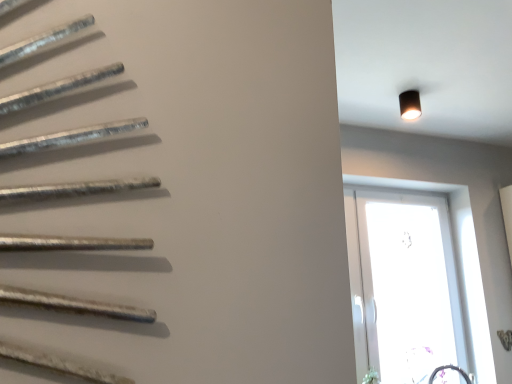
What do you see at coordinates (457, 260) in the screenshot? This screenshot has height=384, width=512. I see `transparent glass window at right` at bounding box center [457, 260].

What is the approximate width of transparent glass window at right?

transparent glass window at right is 3.78 inches wide.

This screenshot has height=384, width=512. What are the coordinates of `transparent glass window at right` in the screenshot? It's located at (457, 260).

The image size is (512, 384). In order to click on black matte light fixture at upper right in this screenshot , I will do `click(410, 104)`.

What do you see at coordinates (410, 104) in the screenshot? The width and height of the screenshot is (512, 384). I see `black matte light fixture at upper right` at bounding box center [410, 104].

Locate an element on the screen. transparent glass window at right is located at coordinates (457, 260).

Is black matte light fixture at upper right at the right side of transparent glass window at right?

No, black matte light fixture at upper right is not to the right of transparent glass window at right.

Which object is closer to the camera, black matte light fixture at upper right or transparent glass window at right?

black matte light fixture at upper right is more forward.

Does point (410, 103) come behind point (347, 177)?

No, (410, 103) is closer to viewer.

From the image's perspective, is black matte light fixture at upper right under transparent glass window at right?

No.

From a real-world perspective, is black matte light fixture at upper right positioned over transparent glass window at right based on gravity?

Yes, from a real-world perspective, black matte light fixture at upper right is above transparent glass window at right.

Does black matte light fixture at upper right have a lesser width compared to transparent glass window at right?

Incorrect, the width of black matte light fixture at upper right is not less than that of transparent glass window at right.

Who is taller, black matte light fixture at upper right or transparent glass window at right?

transparent glass window at right is taller.

Looking at this image, in terms of size, does black matte light fixture at upper right appear bigger or smaller than transparent glass window at right?

Considering their sizes, black matte light fixture at upper right takes up less space than transparent glass window at right.

Is black matte light fixture at upper right outside of transparent glass window at right?

Yes, black matte light fixture at upper right is located beyond the bounds of transparent glass window at right.

Are black matte light fixture at upper right and transparent glass window at right making contact?

black matte light fixture at upper right and transparent glass window at right are clearly separated.

Does black matte light fixture at upper right turn towards transparent glass window at right?

No, black matte light fixture at upper right is not turned towards transparent glass window at right.

How different are the orientations of black matte light fixture at upper right and transparent glass window at right in degrees?

The angular difference between black matte light fixture at upper right and transparent glass window at right is 0.445 degrees.

From the picture: Measure the distance from black matte light fixture at upper right to transparent glass window at right.

A distance of 32.99 inches exists between black matte light fixture at upper right and transparent glass window at right.

Locate an element on the screen. Image resolution: width=512 pixels, height=384 pixels. light fixture above the transparent glass window at right (from the image's perspective) is located at coordinates (x=410, y=104).

Is transparent glass window at right to the left or to the right of black matte light fixture at upper right in the image?

Clearly, transparent glass window at right is on the right of black matte light fixture at upper right in the image.

Is the position of transparent glass window at right more distant than that of black matte light fixture at upper right?

Yes, it is.

Between point (418, 183) and point (413, 104), which one is positioned behind?

The point (418, 183) is behind.

From the image's perspective, who appears lower, transparent glass window at right or black matte light fixture at upper right?

transparent glass window at right is shown below in the image.

From a real-world perspective, is transparent glass window at right positioned over black matte light fixture at upper right based on gravity?

No, from a real-world perspective, transparent glass window at right is not above black matte light fixture at upper right.

Is transparent glass window at right wider than black matte light fixture at upper right?

No.

Looking at this image, who is shorter, transparent glass window at right or black matte light fixture at upper right?

black matte light fixture at upper right is shorter.

Which of these two, transparent glass window at right or black matte light fixture at upper right, is smaller?

Smaller between the two is black matte light fixture at upper right.

Is transparent glass window at right positioned beyond the bounds of black matte light fixture at upper right?

Yes, transparent glass window at right is not within black matte light fixture at upper right.

Does transparent glass window at right touch black matte light fixture at upper right?

There is a gap between transparent glass window at right and black matte light fixture at upper right.

From the picture: Is transparent glass window at right turned away from black matte light fixture at upper right?

No, transparent glass window at right is not facing the opposite direction of black matte light fixture at upper right.

Image resolution: width=512 pixels, height=384 pixels. In order to click on window behind the black matte light fixture at upper right in this screenshot , I will do `click(457, 260)`.

The image size is (512, 384). I want to click on light fixture above the transparent glass window at right (from a real-world perspective), so click(410, 104).

At what (x,y) coordinates should I click in order to perform the action: click on window below the black matte light fixture at upper right (from a real-world perspective). Please return your answer as a coordinate pair (x, y). The height and width of the screenshot is (384, 512). Looking at the image, I should click on (457, 260).